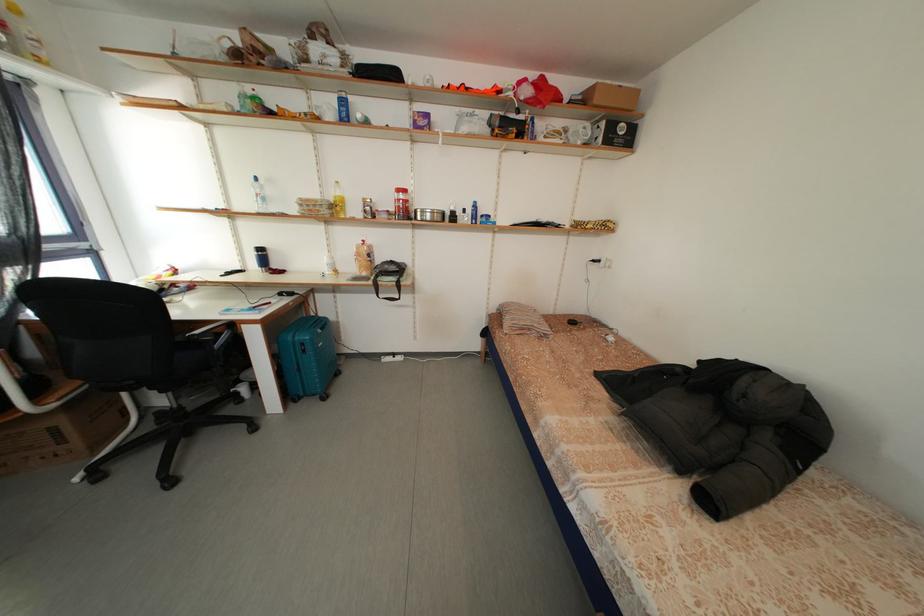
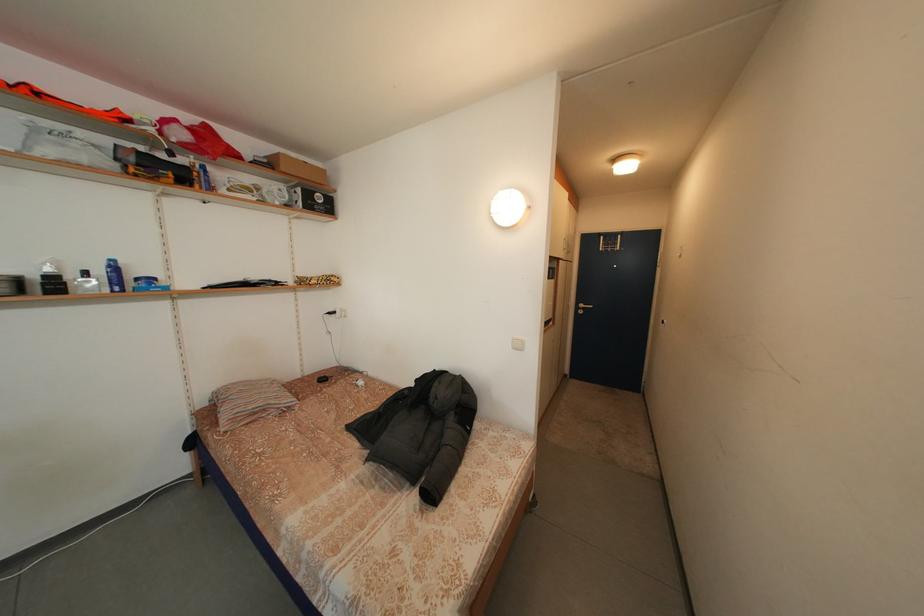
Locate, in the second image, the point that corresponds to point (490, 222) in the first image.

(146, 285)